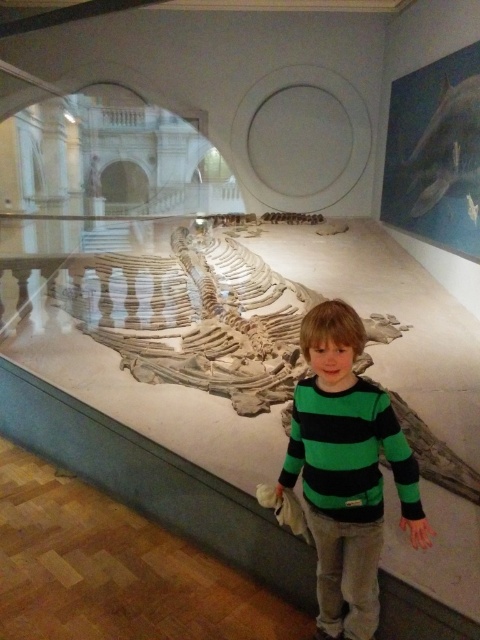
Question: Which of the following is the farthest from the observer?

Choices:
 (A) green striped sweater at center
 (B) gray matte skull at upper right

Answer: (B)

Question: Does green striped sweater at center appear under gray matte skull at upper right?

Choices:
 (A) yes
 (B) no

Answer: (A)

Question: Which point is closer to the camera?

Choices:
 (A) (347, 557)
 (B) (467, 108)

Answer: (A)

Question: Which object appears farthest from the camera in this image?

Choices:
 (A) gray matte skull at upper right
 (B) green striped sweater at center

Answer: (A)

Question: Is green striped sweater at center wider than gray matte skull at upper right?

Choices:
 (A) yes
 (B) no

Answer: (A)

Question: Is green striped sweater at center below gray matte skull at upper right?

Choices:
 (A) no
 (B) yes

Answer: (B)